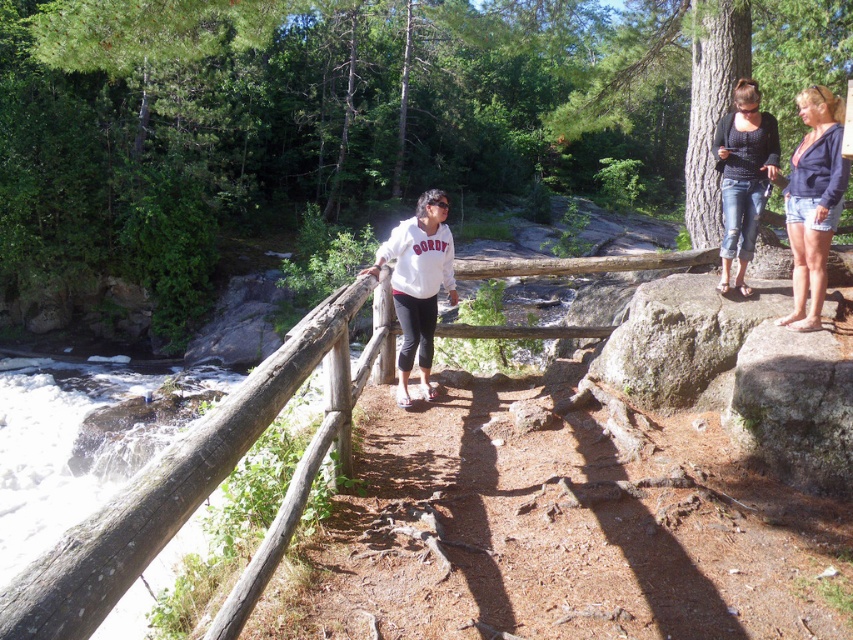
Question: Which object is positioned farthest from the white matte sweatshirt at center?

Choices:
 (A) wooden rail at left
 (B) white frothy water at lower left
 (C) denim jeans at upper right
 (D) denim shorts at upper right

Answer: (B)

Question: Which point is farther from the camera taking this photo?

Choices:
 (A) (799, 104)
 (B) (103, 374)
 (C) (7, 627)
 (D) (735, 288)

Answer: (B)

Question: Which point is closer to the camera?

Choices:
 (A) tap(339, 321)
 (B) tap(831, 228)
 (C) tap(421, 336)
 (D) tap(190, 413)

Answer: (A)

Question: Can you confirm if wooden rail at left is bigger than white frothy water at lower left?

Choices:
 (A) no
 (B) yes

Answer: (A)

Question: Can you confirm if denim shorts at upper right is wider than denim jeans at upper right?

Choices:
 (A) no
 (B) yes

Answer: (A)

Question: Can you confirm if denim shorts at upper right is positioned to the right of white matte sweatshirt at center?

Choices:
 (A) yes
 (B) no

Answer: (A)